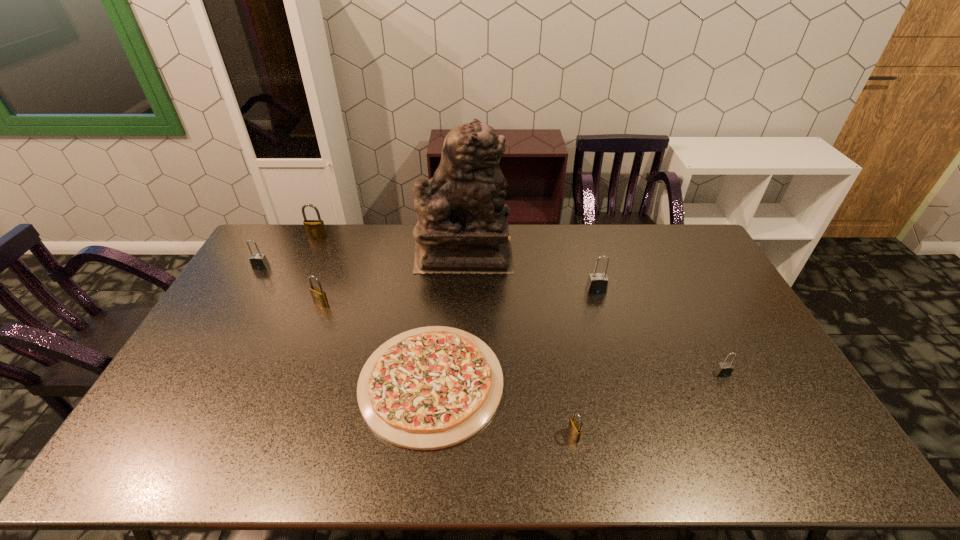
Locate which gray padlock ranks second in proximity to the seventh object from right to left. Please provide its 2D coordinates. Your answer should be formatted as a tuple, i.e. [(x, y)], where the tuple contains the x and y coordinates of a point satisfying the conditions above.

[(597, 283)]